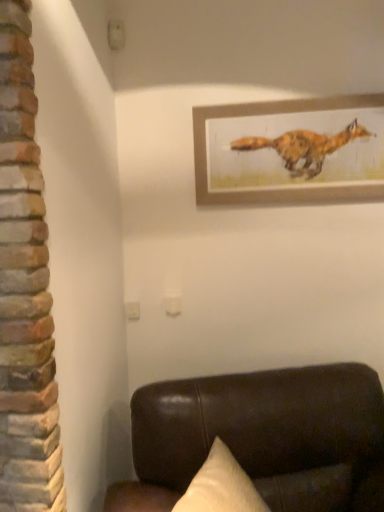
Question: Is point (258, 169) closer or farther from the camera than point (314, 374)?

Choices:
 (A) closer
 (B) farther

Answer: (B)

Question: From the image's perspective, is wooden framed fox painting at upper center located above or below brown leather couch at lower right?

Choices:
 (A) below
 (B) above

Answer: (B)

Question: From a real-world perspective, is wooden framed fox painting at upper center physically located above or below brown leather couch at lower right?

Choices:
 (A) below
 (B) above

Answer: (B)

Question: Looking at their shapes, would you say brown leather couch at lower right is wider or thinner than wooden framed fox painting at upper center?

Choices:
 (A) thin
 (B) wide

Answer: (B)

Question: Visually, is brown leather couch at lower right positioned to the left or to the right of wooden framed fox painting at upper center?

Choices:
 (A) right
 (B) left

Answer: (B)

Question: Is brown leather couch at lower right taller or shorter than wooden framed fox painting at upper center?

Choices:
 (A) tall
 (B) short

Answer: (A)

Question: Choose the correct answer: Is brown leather couch at lower right inside wooden framed fox painting at upper center or outside it?

Choices:
 (A) inside
 (B) outside

Answer: (B)